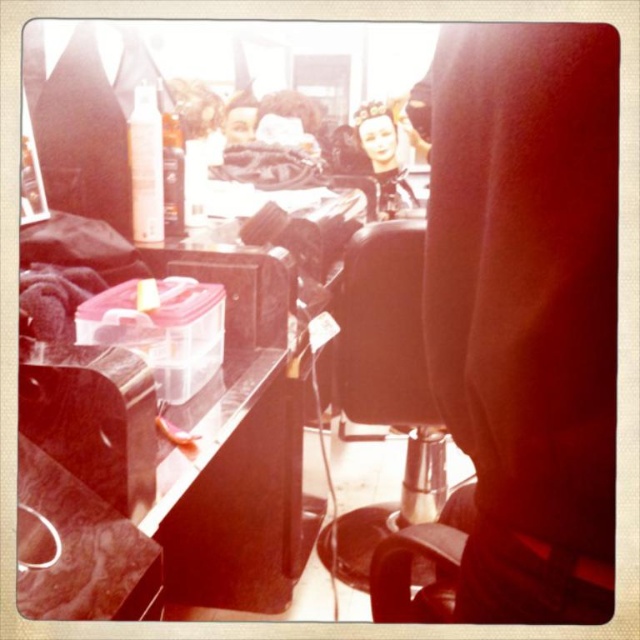
Who is lower down, black leather barber chair at center or blonde synthetic wig at center?

Positioned lower is black leather barber chair at center.

Can you confirm if black leather barber chair at center is thinner than blonde synthetic wig at center?

Yes.

Does point (540, 420) come closer to viewer compared to point (307, 129)?

Yes, it is.

This screenshot has height=640, width=640. Identify the location of black leather barber chair at center. (528, 308).

Based on the photo, can you confirm if black leather swivel chair at center is positioned to the left of blonde synthetic wig at center?

No, black leather swivel chair at center is not to the left of blonde synthetic wig at center.

Between point (406, 484) and point (301, 100), which one is positioned in front?

Point (406, 484)

This screenshot has width=640, height=640. I want to click on black leather swivel chair at center, so click(385, 381).

Who is shorter, smooth porcelain doll at center or blonde synthetic wig at center?

blonde synthetic wig at center is shorter.

Find the location of a particular element. This screenshot has width=640, height=640. smooth porcelain doll at center is located at coordinates (385, 154).